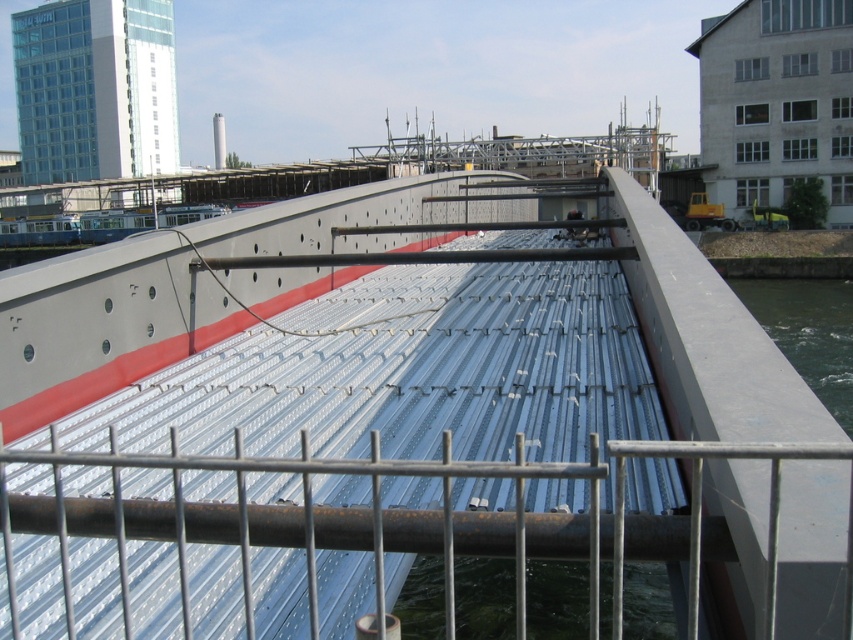
You are a surveyor checking the alignment of the bridge components. The silver metallic rail at center must align with the bridge deck edges. Based on its coordinates, is the rail positioned correctly along the bridge deck?

The silver metallic rail at center is located at point (x=399, y=518), which should align with the bridge deck edges as described in the scene. Therefore, the rail is positioned correctly.

You are a crane operator tasked with lowering a heavy crate onto the metallic silver boat at center. The crate requires a minimum clearance of 2 meters to safely descend. Based on the scene, can you safely lower the crate onto the boat?

The metallic silver boat at center is 1.69 meters away from camera. Since the required clearance is 2 meters, the distance is insufficient. You cannot safely lower the crate onto the boat.

You are a photographer planning to capture the construction site with the metallic silver boat at center and the clear water at right. Based on the scene, which object takes up more area in the image?

The clear water at right occupies more area than the metallic silver boat at center in the image.